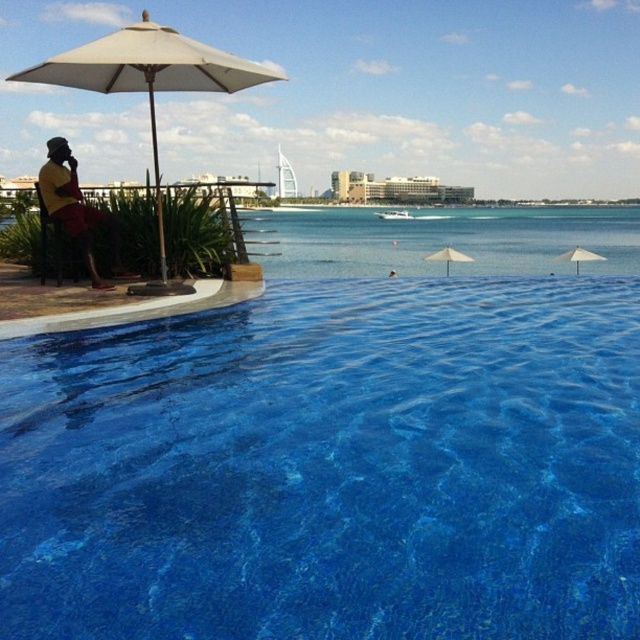
You are standing at the infinity pool and want to take a photo of two specific points marked in the scene. The first point is at coordinate point (x=371, y=220) and the second is at point (x=579, y=260). Which point will appear closer to the camera in your photo?

Point (x=371, y=220) is further to the camera than point (x=579, y=260), so the first point will appear closer in the photo.

You are planning to take a photo of the transparent glass water at center and the beige fabric umbrella at upper left. Which object should you focus on first if you want to capture both in a single frame without moving the camera? Explain your reasoning based on their sizes.

The transparent glass water at center is wider than the beige fabric umbrella at upper left. Therefore, focusing on the transparent glass water at center first would ensure it occupies more of the frame, allowing the smaller beige fabric umbrella at upper left to fit within the same shot without needing to adjust the camera position.

You are standing at the edge of the infinity pool and want to walk to the white fabric umbrella at right without stepping into the transparent glass water at center. Which direction should you move relative to the umbrella?

You should move to the left relative to the white fabric umbrella at right because the transparent glass water at center is located to its right side.